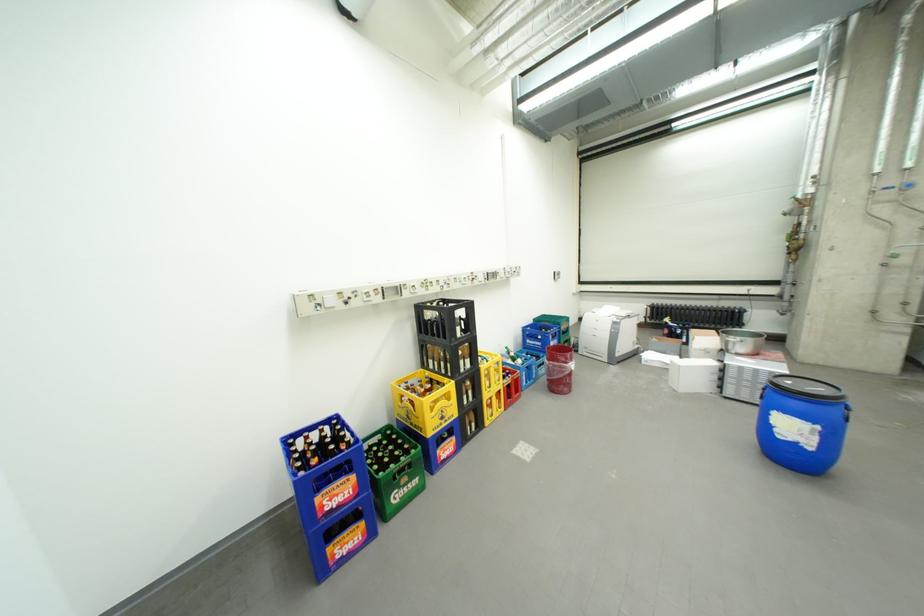
What do you see at coordinates (847, 411) in the screenshot?
I see `a blue barrer handle` at bounding box center [847, 411].